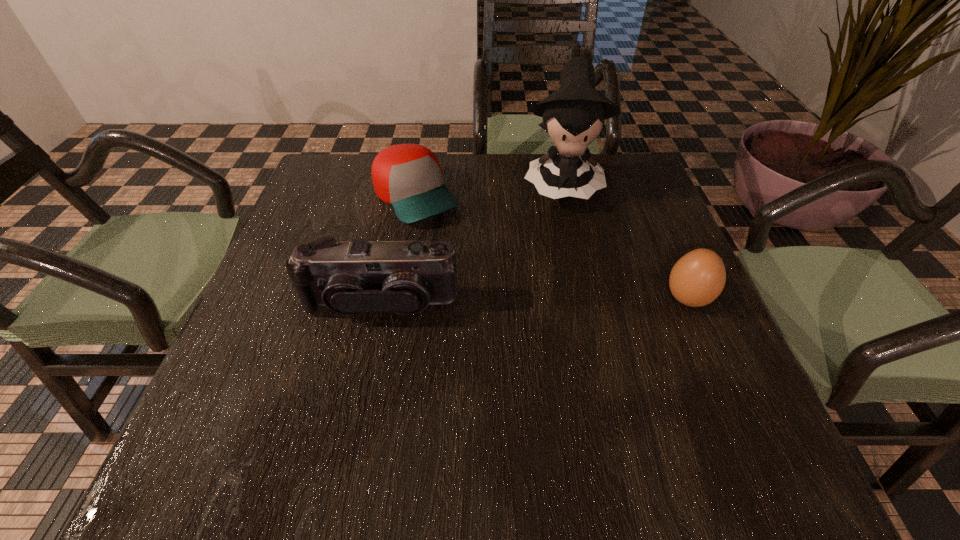
Identify the location of camcorder. (350, 278).

This screenshot has width=960, height=540. I want to click on boiled egg, so click(x=697, y=279).

Find the location of a particular element. The height and width of the screenshot is (540, 960). the tallest object is located at coordinates (573, 115).

Where is `doll`? The image size is (960, 540). doll is located at coordinates (573, 115).

Find the location of a particular element. The image size is (960, 540). baseball cap is located at coordinates (408, 177).

Where is `vacant area located 0.050m on the front-facing side of the camcorder`? vacant area located 0.050m on the front-facing side of the camcorder is located at coordinates (372, 346).

In order to click on free spot located 0.120m on the back of the boiled egg in this screenshot , I will do `click(663, 244)`.

The height and width of the screenshot is (540, 960). I want to click on free space located 0.210m at the face of the tallest object, so click(567, 275).

Where is `vacant space located 0.130m at the face of the tallest object`? The height and width of the screenshot is (540, 960). vacant space located 0.130m at the face of the tallest object is located at coordinates (566, 250).

Find the location of `free space located 0.230m at the face of the tallest object`. free space located 0.230m at the face of the tallest object is located at coordinates (568, 282).